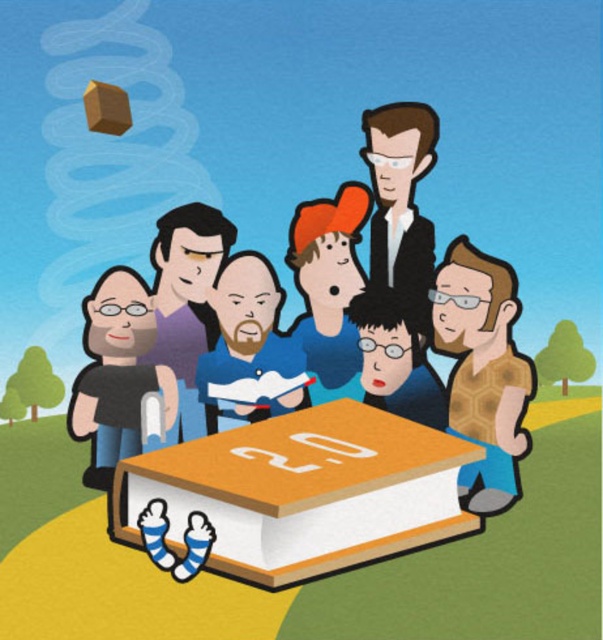
Based on the scene description, which object is positioned lower in the image, the orange matte book at center or the matte purple shirt at center?

The orange matte book at center is positioned below the matte purple shirt at center, so it is lower in the image.